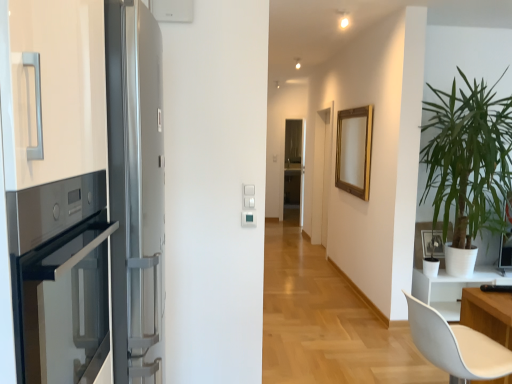
Question: Does white matte picture frame at right, the 1th picture frame positioned from the right, appear on the right side of transparent glass screen door at center?

Choices:
 (A) yes
 (B) no

Answer: (A)

Question: Does white matte picture frame at right, placed as the first picture frame when sorted from front to back, have a greater height compared to transparent glass screen door at center?

Choices:
 (A) yes
 (B) no

Answer: (B)

Question: From the image's perspective, is white matte picture frame at right, the 1th picture frame positioned from the right, on top of transparent glass screen door at center?

Choices:
 (A) no
 (B) yes

Answer: (A)

Question: Is white matte picture frame at right, placed as the first picture frame when sorted from bottom to top, positioned behind transparent glass screen door at center?

Choices:
 (A) no
 (B) yes

Answer: (A)

Question: Can you confirm if white matte picture frame at right, the second picture frame viewed from the back, is wider than transparent glass screen door at center?

Choices:
 (A) yes
 (B) no

Answer: (A)

Question: Can you confirm if gold metallic picture frame at upper center, which is counted as the first picture frame, starting from the top, is thinner than green leafy plant at right?

Choices:
 (A) yes
 (B) no

Answer: (A)

Question: Is gold metallic picture frame at upper center, which is counted as the second picture frame, starting from the bottom, smaller than green leafy plant at right?

Choices:
 (A) no
 (B) yes

Answer: (B)

Question: Considering the relative positions of gold metallic picture frame at upper center, arranged as the second picture frame when viewed from the right, and green leafy plant at right in the image provided, is gold metallic picture frame at upper center, arranged as the second picture frame when viewed from the right, to the right of green leafy plant at right from the viewer's perspective?

Choices:
 (A) yes
 (B) no

Answer: (B)

Question: Does gold metallic picture frame at upper center, the first picture frame in the left-to-right sequence, have a greater height compared to green leafy plant at right?

Choices:
 (A) no
 (B) yes

Answer: (A)

Question: Can you confirm if gold metallic picture frame at upper center, positioned as the second picture frame in front-to-back order, is bigger than green leafy plant at right?

Choices:
 (A) no
 (B) yes

Answer: (A)

Question: Can you confirm if gold metallic picture frame at upper center, which is counted as the first picture frame, starting from the top, is wider than green leafy plant at right?

Choices:
 (A) yes
 (B) no

Answer: (B)

Question: Does white matte chair at lower right lie behind transparent glass screen door at center?

Choices:
 (A) yes
 (B) no

Answer: (B)